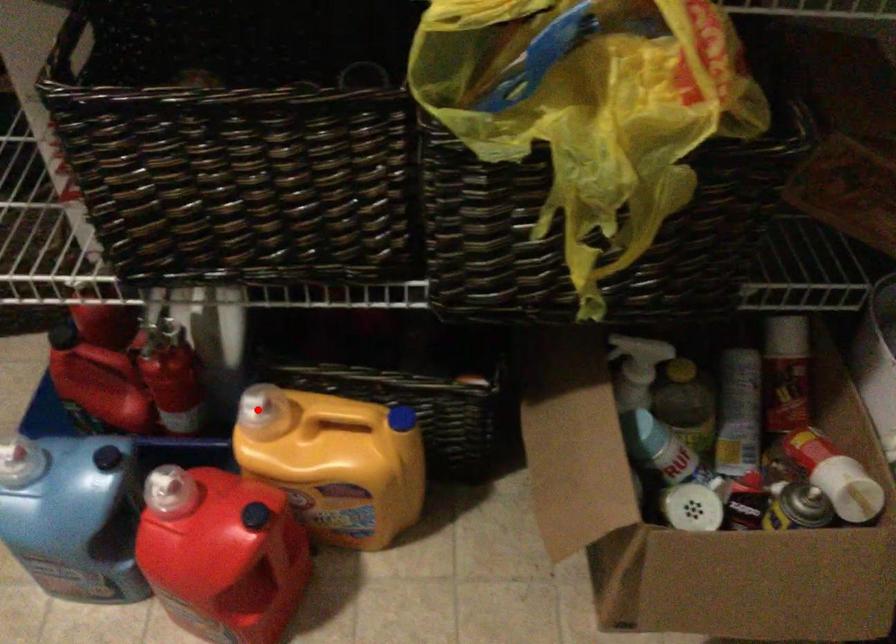
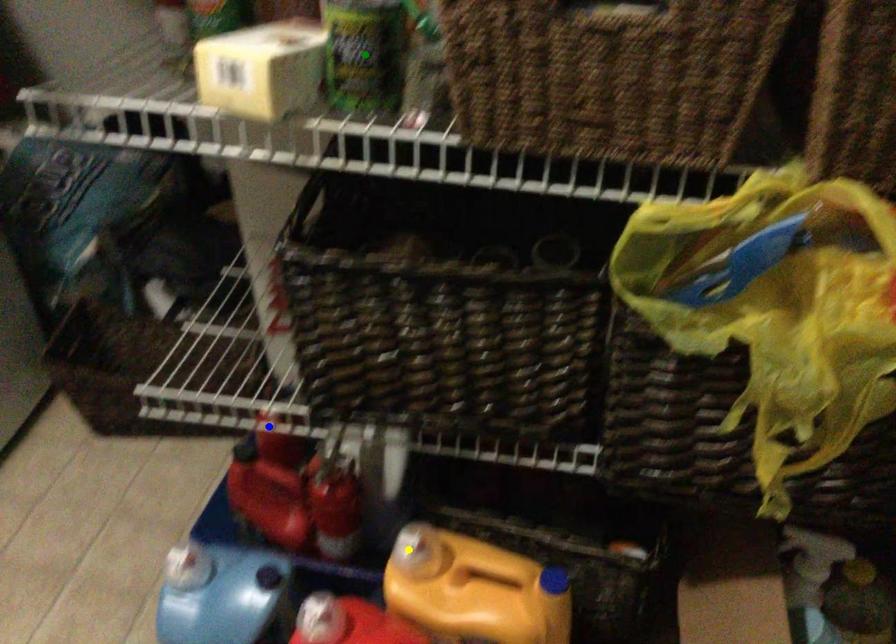
Question: I am providing you with two images of the same scene from different viewpoints. A red point is marked on the first image. You are given multiple points on the second image. In image 2, which mark is for the same physical point as the one in image 1?

Choices:
 (A) green point
 (B) yellow point
 (C) blue point

Answer: (B)